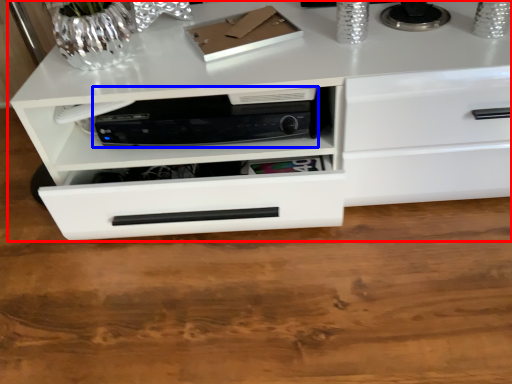
Question: Which point is further to the camera, chest of drawers (highlighted by a red box) or home appliance (highlighted by a blue box)?

Choices:
 (A) chest of drawers
 (B) home appliance

Answer: (B)